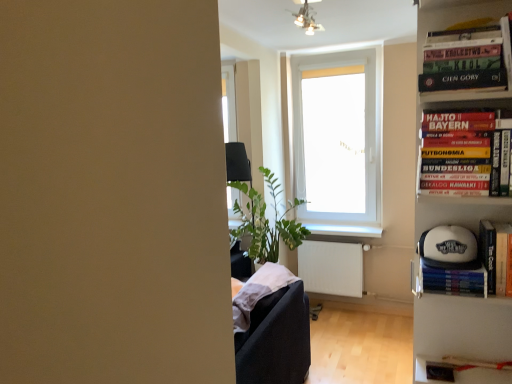
Question: Considering the relative sizes of white matte baseball cap at right, the 1th book from the bottom, and white glossy window sill at center in the image provided, is white matte baseball cap at right, the 1th book from the bottom, thinner than white glossy window sill at center?

Choices:
 (A) no
 (B) yes

Answer: (B)

Question: Can white glossy window sill at center be found inside white matte baseball cap at right, the 1th book from the bottom?

Choices:
 (A) no
 (B) yes

Answer: (A)

Question: From the image's perspective, is white matte baseball cap at right, the third book viewed from the top, on top of white glossy window sill at center?

Choices:
 (A) no
 (B) yes

Answer: (B)

Question: Is white matte baseball cap at right, the 1th book from the bottom, not close to white glossy window sill at center?

Choices:
 (A) no
 (B) yes

Answer: (B)

Question: Is white glossy window sill at center at the back of white matte baseball cap at right, the third book viewed from the top?

Choices:
 (A) yes
 (B) no

Answer: (A)

Question: Considering their positions, is white matte radiator at lower right located in front of or behind white plastic window at center?

Choices:
 (A) behind
 (B) front

Answer: (A)

Question: Considering the positions of white matte radiator at lower right and white plastic window at center in the image, is white matte radiator at lower right taller or shorter than white plastic window at center?

Choices:
 (A) short
 (B) tall

Answer: (A)

Question: From the image's perspective, relative to white plastic window at center, is white matte radiator at lower right above or below?

Choices:
 (A) above
 (B) below

Answer: (B)

Question: Is white matte radiator at lower right wider or thinner than white plastic window at center?

Choices:
 (A) thin
 (B) wide

Answer: (B)

Question: From a real-world perspective, is white glossy window sill at center above or below white matte baseball cap at right, the 1th book from the bottom?

Choices:
 (A) above
 (B) below

Answer: (B)

Question: Which is correct: white glossy window sill at center is inside white matte baseball cap at right, the third book viewed from the top, or outside of it?

Choices:
 (A) outside
 (B) inside

Answer: (A)

Question: Based on their positions, is white glossy window sill at center located to the left or right of white matte baseball cap at right, the third book viewed from the top?

Choices:
 (A) right
 (B) left

Answer: (B)

Question: From the image's perspective, relative to white matte baseball cap at right, the 1th book from the bottom, is white glossy window sill at center above or below?

Choices:
 (A) above
 (B) below

Answer: (B)

Question: Looking at their shapes, would you say white glossy window sill at center is wider or thinner than white plastic window at center?

Choices:
 (A) thin
 (B) wide

Answer: (B)

Question: Is point (349, 228) positioned closer to the camera than point (356, 56)?

Choices:
 (A) farther
 (B) closer

Answer: (A)